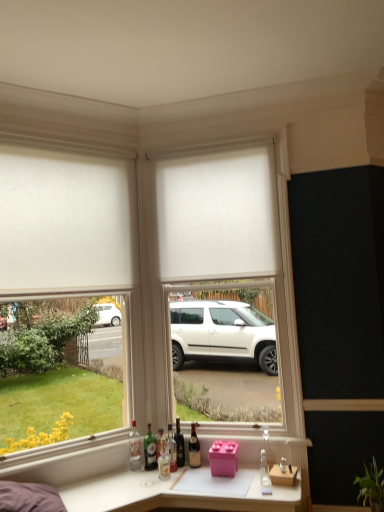
Locate an element on the screen. Image resolution: width=384 pixels, height=512 pixels. free area in between green glass bottle at lower center, which appears as the second bottle when viewed from the left, and clear glass bottle at center, positioned as the seventh bottle in left-to-right order is located at coordinates (210, 477).